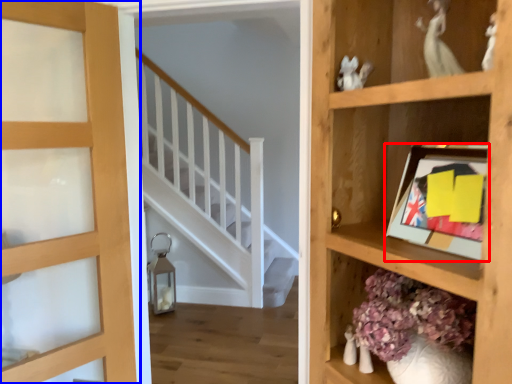
Question: Which point is further to the camera, picture frame (highlighted by a red box) or door (highlighted by a blue box)?

Choices:
 (A) picture frame
 (B) door

Answer: (B)